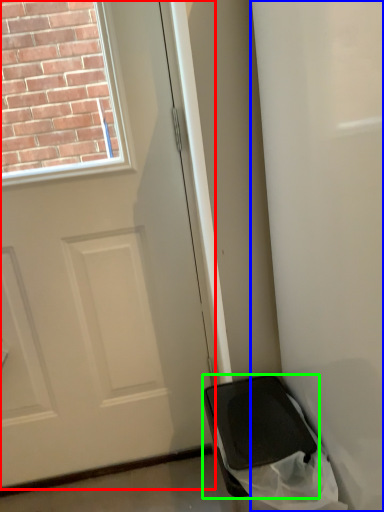
Question: Estimate the real-world distances between objects in this image. Which object is closer to door (highlighted by a red box), screen door (highlighted by a blue box) or furniture (highlighted by a green box)?

Choices:
 (A) screen door
 (B) furniture

Answer: (B)